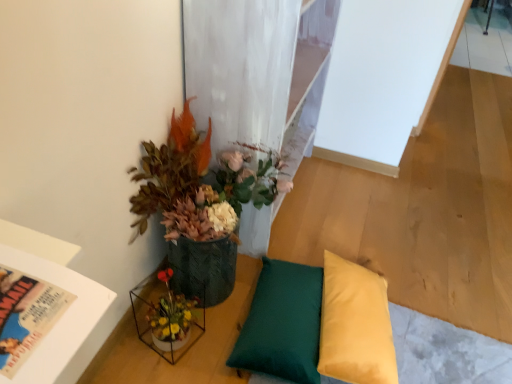
Question: In terms of height, does green fabric pillow at lower center, marked as the second pillow in a right-to-left arrangement, look taller or shorter compared to translucent glass vase at lower left?

Choices:
 (A) tall
 (B) short

Answer: (B)

Question: From a real-world perspective, relative to translucent glass vase at lower left, is green fabric pillow at lower center, marked as the second pillow in a right-to-left arrangement, vertically above or below?

Choices:
 (A) above
 (B) below

Answer: (B)

Question: Estimate the real-world distances between objects in this image. Which object is farther from the yellow fabric pillow at lower right, which is the second pillow in left-to-right order?

Choices:
 (A) green fabric pillow at lower center, the 1th pillow when ordered from left to right
 (B) textured green pot at upper left
 (C) translucent glass vase at lower left

Answer: (C)

Question: Which object is the closest to the translucent glass vase at lower left?

Choices:
 (A) green fabric pillow at lower center, marked as the second pillow in a right-to-left arrangement
 (B) textured green pot at upper left
 (C) yellow fabric pillow at lower right, acting as the 1th pillow starting from the right

Answer: (B)